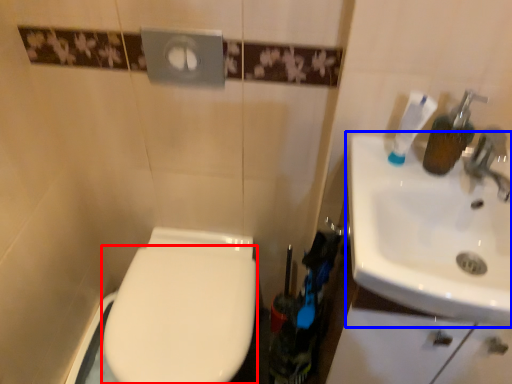
Question: Among these objects, which one is nearest to the camera, bidet (highlighted by a red box) or sink (highlighted by a blue box)?

Choices:
 (A) bidet
 (B) sink

Answer: (B)